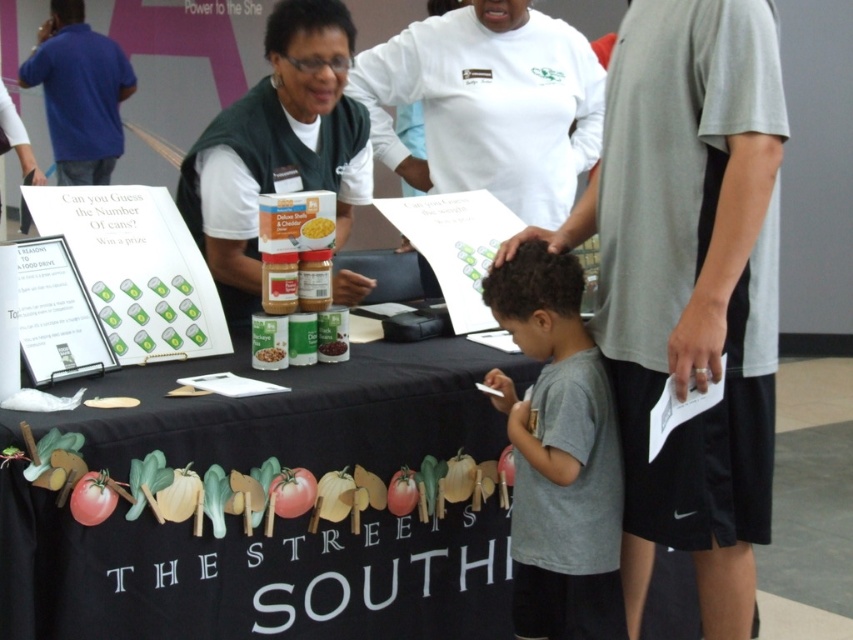
Does point (497, 301) come behind point (86, 164)?

No.

Can you confirm if gray cotton shirt at lower center is positioned above blue cotton shirt at upper left?

No.

Is point (483, 285) farther from viewer compared to point (54, 140)?

No, it is not.

At what (x,y) coordinates should I click in order to perform the action: click on gray cotton shirt at lower center. Please return your answer as a coordinate pair (x, y). Image resolution: width=853 pixels, height=640 pixels. Looking at the image, I should click on (558, 454).

What do you see at coordinates (558, 454) in the screenshot? I see `gray cotton shirt at lower center` at bounding box center [558, 454].

Is gray cotton shirt at lower center to the right of yellow matte corn at center from the viewer's perspective?

Indeed, gray cotton shirt at lower center is positioned on the right side of yellow matte corn at center.

This screenshot has height=640, width=853. Find the location of `gray cotton shirt at lower center`. gray cotton shirt at lower center is located at coordinates (558, 454).

Who is lower down, black fabric table at center or blue cotton shirt at upper left?

black fabric table at center is lower down.

Is black fabric table at center thinner than blue cotton shirt at upper left?

No.

I want to click on black fabric table at center, so click(247, 576).